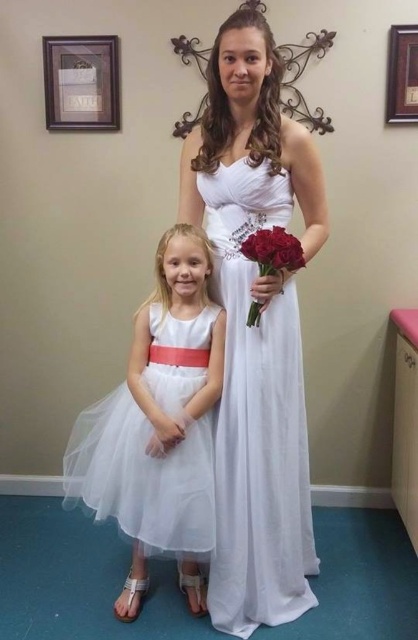
You are a photographer positioned at the front of the scene. You need to take a photo of both the white satin dress at center and the matte red roses at center. Which object should you focus on first to ensure it appears sharp in the photo?

The white satin dress at center is closer to you than the matte red roses at center, so you should focus on the white satin dress at center first to ensure it appears sharp in the photo.

Looking at this image, you are standing at the origin point in the image. You want to walk to the point at (267,531). However, there is an obstacle at point (111,451). Will you encounter the obstacle before reaching your destination?

Point (267,531) is behind point (111,451), so you will encounter the obstacle at point (111,451) before reaching your destination.

You are a photographer setting up for a photo shoot. You need to position a light source in front of the white satin dress at center and the white tulle dress at center. Since you want the light to hit both dresses equally, where should you place the light source relative to the two dresses?

The white satin dress at center is closer to the viewer than the white tulle dress at center, so to ensure equal lighting on both, the light source should be placed closer to the white tulle dress at center to compensate for its greater distance from the light.